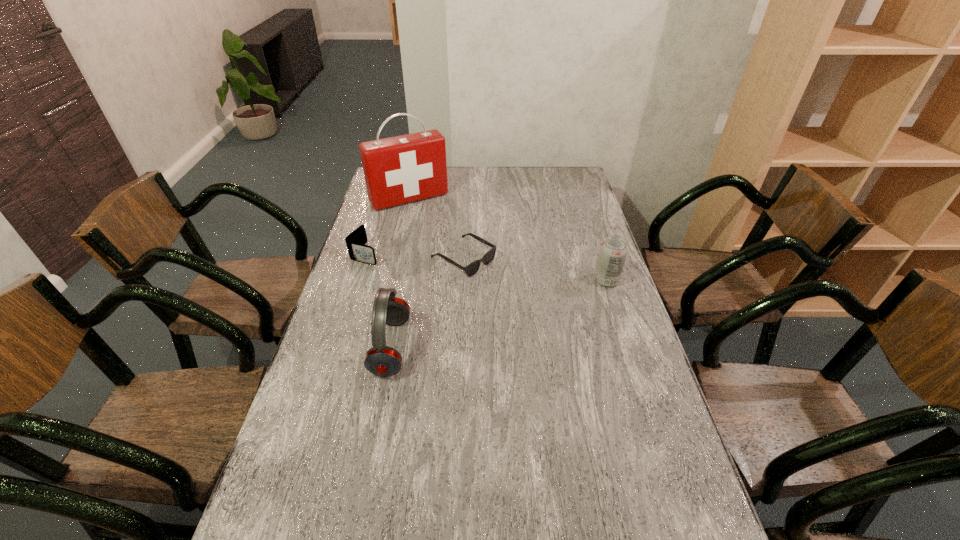
Locate an element on the screen. The width and height of the screenshot is (960, 540). vacant region located on the front face of the farthest object is located at coordinates (x=437, y=231).

I want to click on object positioned at the far edge, so click(398, 170).

Find the location of a particular element. This screenshot has width=960, height=540. earphone that is at the left edge is located at coordinates (381, 360).

This screenshot has width=960, height=540. In order to click on wallet at the left edge in this screenshot , I will do `click(358, 251)`.

The height and width of the screenshot is (540, 960). What are the coordinates of `the first-aid kit located in the left edge section of the desktop` in the screenshot? It's located at (398, 170).

Locate an element on the screen. Image resolution: width=960 pixels, height=540 pixels. object located in the right edge section of the desktop is located at coordinates (613, 251).

In order to click on object present at the far left corner in this screenshot , I will do `click(398, 170)`.

What are the coordinates of `free spot at the far edge of the desktop` in the screenshot? It's located at (516, 173).

Identify the location of free space at the left edge. (326, 445).

In the image, there is a desktop. What are the coordinates of `vacant region at the right edge` in the screenshot? It's located at (606, 312).